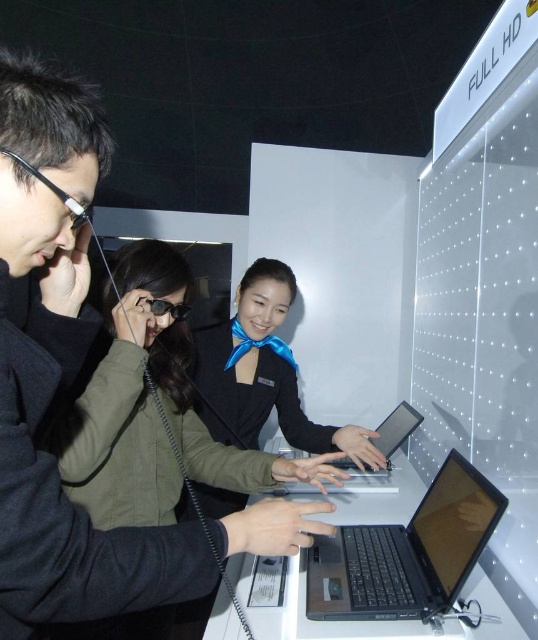
You are at the exhibition and need to locate the matte black laptop at center. According to the coordinates provided, where exactly is it positioned in the image?

The matte black laptop at center is positioned at the coordinates point (60,376).

You are setting up a display for an electronics exhibition and have two laptops, the black matte laptop at center and the silver metallic laptop at center. If you need to place them side by side on a shelf that can only accommodate the width of the narrower laptop, which one should you choose to ensure they both fit?

The silver metallic laptop at center should be chosen because the black matte laptop at center is wider, so placing both side by side would exceed the shelf width. The silver metallic laptop at center is narrower and thus both can fit if only the narrower one is selected.

You are a tech journalist attending the exhibition and want to take a photo of both the black matte laptop at center and the silver metallic laptop at center. Which one should you focus on first to ensure both are in sharp focus?

You should focus on the black matte laptop at center first since it is closer to you than the silver metallic laptop at center, ensuring both are in sharp focus when using a shallow depth of field.